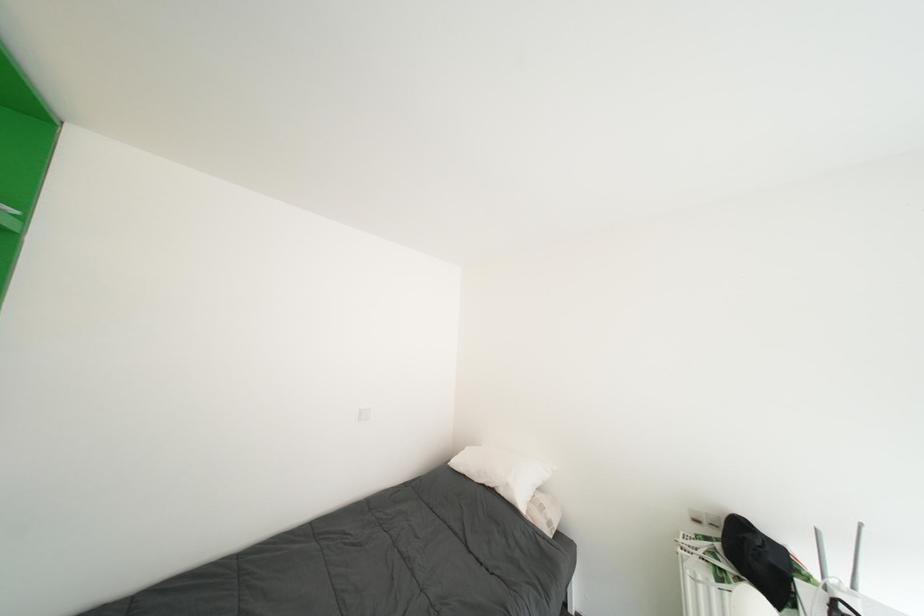
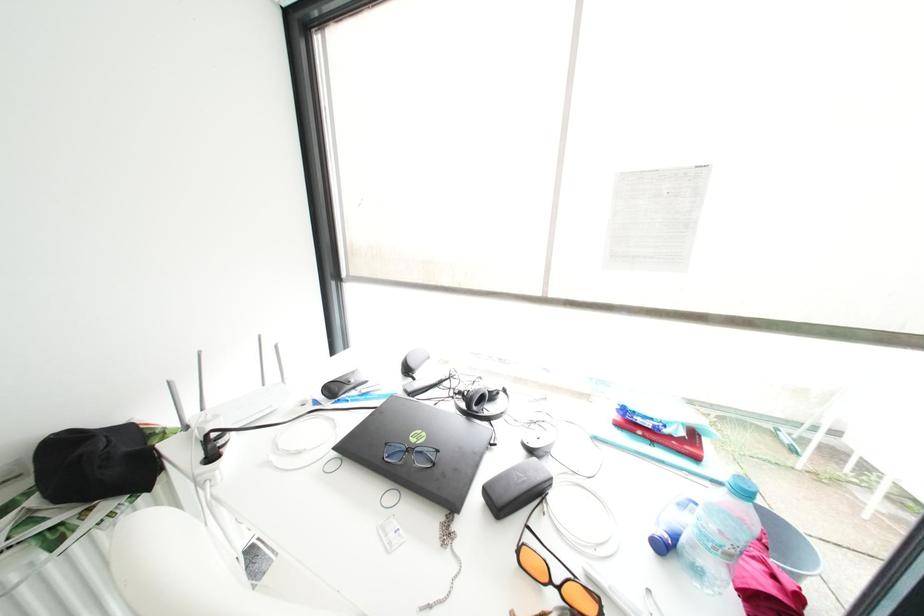
Based on the continuous images, in which direction is the camera rotating?

The camera's rotation is toward right-down.